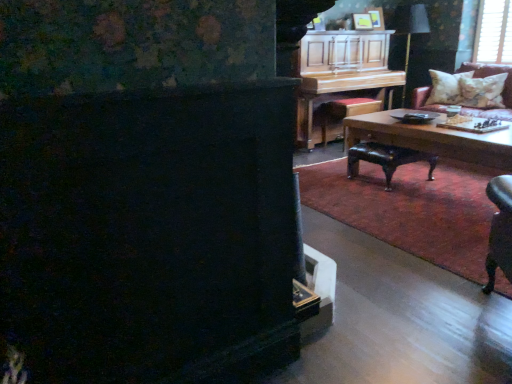
Question: Does leather couch with floral pillows at upper right come in front of matte yellow picture frame at upper center?

Choices:
 (A) no
 (B) yes

Answer: (B)

Question: Is leather couch with floral pillows at upper right positioned with its back to matte yellow picture frame at upper center?

Choices:
 (A) no
 (B) yes

Answer: (A)

Question: Does leather couch with floral pillows at upper right have a lesser height compared to matte yellow picture frame at upper center?

Choices:
 (A) yes
 (B) no

Answer: (B)

Question: Is leather couch with floral pillows at upper right bigger than matte yellow picture frame at upper center?

Choices:
 (A) yes
 (B) no

Answer: (A)

Question: From the image's perspective, is leather couch with floral pillows at upper right over matte yellow picture frame at upper center?

Choices:
 (A) yes
 (B) no

Answer: (B)

Question: From the image's perspective, is leather couch with floral pillows at upper right under matte yellow picture frame at upper center?

Choices:
 (A) yes
 (B) no

Answer: (A)

Question: Can you confirm if white textured pillow at upper right, which is counted as the 1th pillow, starting from the front, is thinner than wooden piano at upper right?

Choices:
 (A) yes
 (B) no

Answer: (A)

Question: Considering the relative sizes of white textured pillow at upper right, arranged as the second pillow when viewed from the back, and wooden piano at upper right in the image provided, is white textured pillow at upper right, arranged as the second pillow when viewed from the back, wider than wooden piano at upper right?

Choices:
 (A) no
 (B) yes

Answer: (A)

Question: Is white textured pillow at upper right, arranged as the second pillow when viewed from the back, positioned beyond the bounds of wooden piano at upper right?

Choices:
 (A) no
 (B) yes

Answer: (B)

Question: From the image's perspective, does white textured pillow at upper right, which is counted as the 1th pillow, starting from the front, appear higher than wooden piano at upper right?

Choices:
 (A) yes
 (B) no

Answer: (B)

Question: From the image's perspective, does white textured pillow at upper right, arranged as the second pillow when viewed from the back, appear lower than wooden piano at upper right?

Choices:
 (A) yes
 (B) no

Answer: (A)

Question: Does white textured pillow at upper right, which is counted as the 1th pillow, starting from the front, turn towards wooden piano at upper right?

Choices:
 (A) no
 (B) yes

Answer: (A)

Question: Can you confirm if fluffy beige pillow at upper right, the 2th pillow when ordered from front to back, is wider than leather couch with floral pillows at upper right?

Choices:
 (A) no
 (B) yes

Answer: (A)